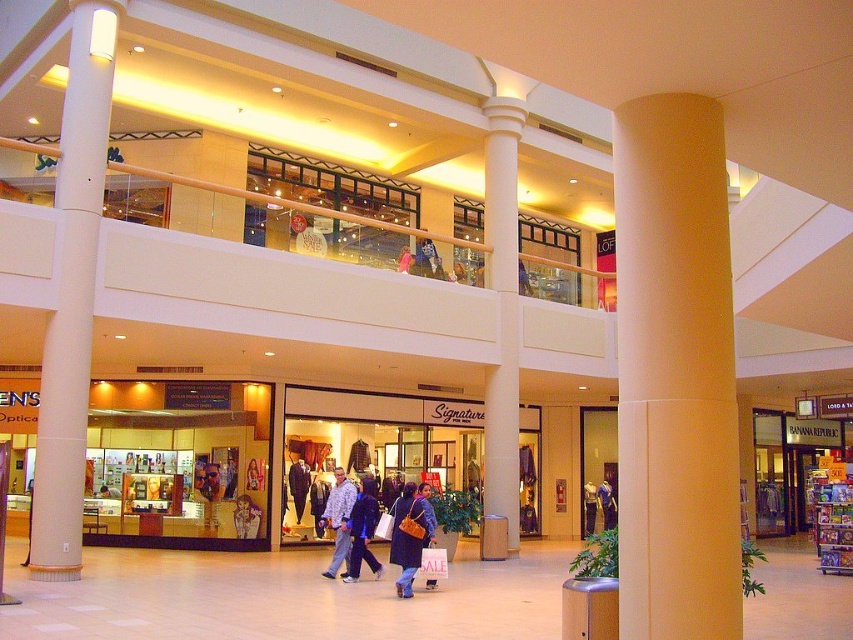
You are a customer entering the mall and want to find the nearest fitting room. You see the beige smooth column at center and the dark blue suit at center. Which one is closer to your current position?

The dark blue suit at center is closer to your current position because the beige smooth column at center is much taller, implying it is further away.

You are a customer in the shopping mall looking for a jacket. You see the dark blue suit at center and the denim jacket at center. Which one is closer to your right side?

The denim jacket at center is closer to your right side because the dark blue suit at center is to the left of it.